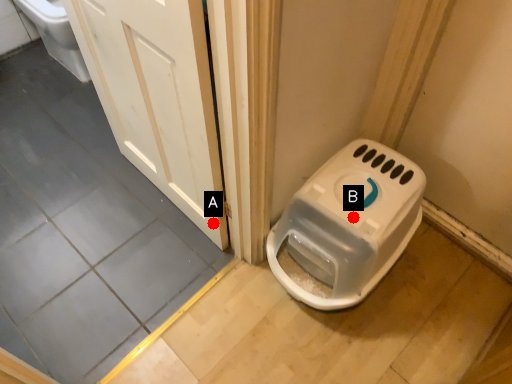
Question: Two points are circled on the image, labeled by A and B beside each circle. Which point is further to the camera?

Choices:
 (A) A is further
 (B) B is further

Answer: (A)